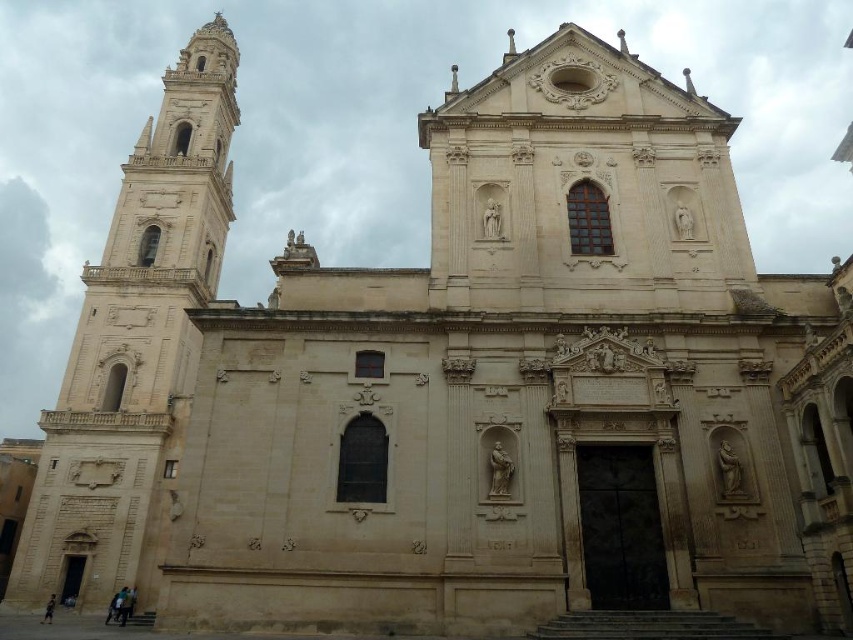
You are an architect visiting the church and notice the smooth beige statue at center and the light brown sandal at lower left. Which object has a smaller width?

The smooth beige statue at center is thinner than the light brown sandal at lower left, so the smooth beige statue at center has a smaller width.

You are standing in front of the historic church and want to take a photo. There are two points marked on the bell tower, point (39, 600) and point (51, 609). Which point is closer to you when you are facing the church?

Point (39, 600) is further to the camera than point (51, 609), so point (51, 609) is closer to you when facing the church.